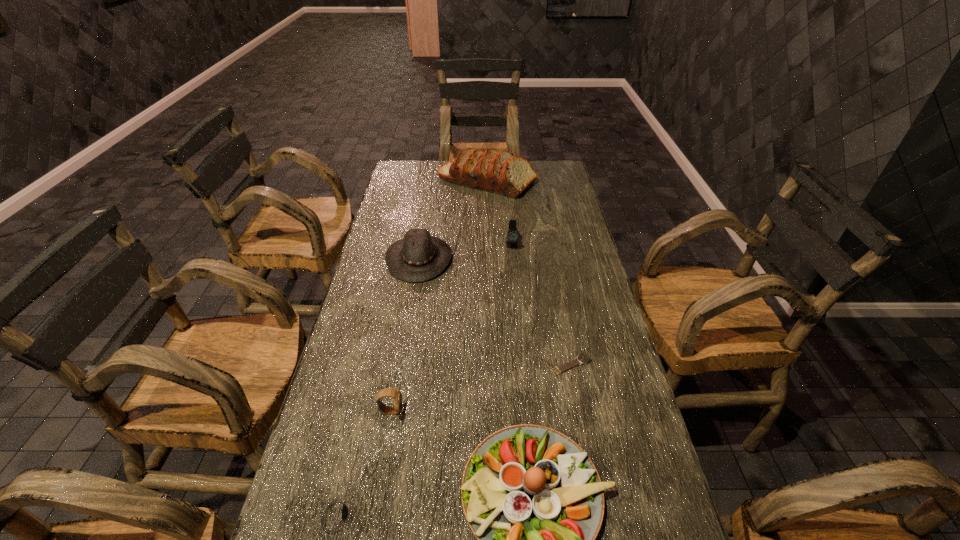
Locate which watch is the closest to the tallest watch. Please provide its 2D coordinates. Your answer should be formatted as a tuple, i.e. [(x, y)], where the tuple contains the x and y coordinates of a point satisfying the conditions above.

[(584, 358)]

The height and width of the screenshot is (540, 960). Find the location of `free space in the image that satisfies the following two spatial constraints: 1. on the face of the tallest watch; 2. on the front-facing side of the hat`. free space in the image that satisfies the following two spatial constraints: 1. on the face of the tallest watch; 2. on the front-facing side of the hat is located at coordinates (514, 258).

Image resolution: width=960 pixels, height=540 pixels. I want to click on free spot that satisfies the following two spatial constraints: 1. on the front side of the shortest watch; 2. on the right side of the farthest object, so click(492, 365).

Identify the location of free region that satisfies the following two spatial constraints: 1. on the face of the tallest watch; 2. on the right side of the shortest watch. (523, 365).

At what (x,y) coordinates should I click in order to perform the action: click on vacant space that satisfies the following two spatial constraints: 1. on the face of the third watch from left to right; 2. on the face of the fifth farthest object. Please return your answer as a coordinate pair (x, y). Looking at the image, I should click on (527, 411).

At what (x,y) coordinates should I click in order to perform the action: click on free region that satisfies the following two spatial constraints: 1. on the front side of the third nearest watch; 2. on the face of the third farthest watch. Please return your answer as a coordinate pair (x, y). The width and height of the screenshot is (960, 540). Looking at the image, I should click on (581, 411).